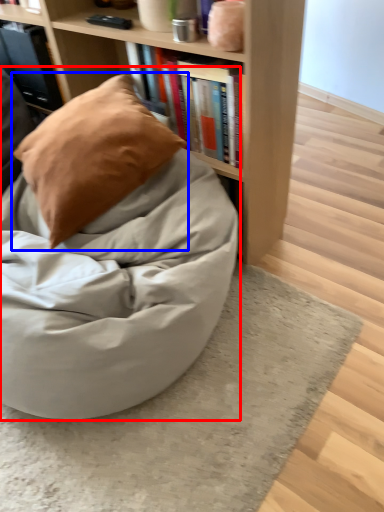
Question: Which object is further to the camera taking this photo, bean bag chair (highlighted by a red box) or pillow (highlighted by a blue box)?

Choices:
 (A) bean bag chair
 (B) pillow

Answer: (B)